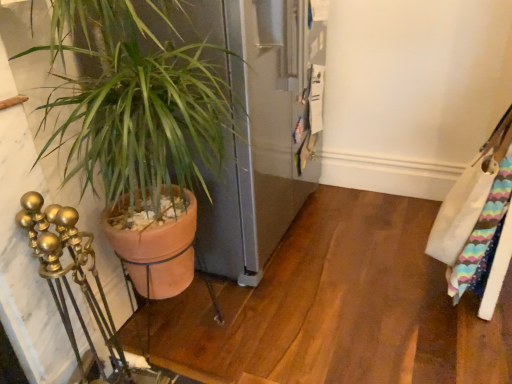
Question: Does terracotta pot at left lie behind white fabric messenger bag at right?

Choices:
 (A) no
 (B) yes

Answer: (A)

Question: Does terracotta pot at left lie in front of white fabric messenger bag at right?

Choices:
 (A) yes
 (B) no

Answer: (A)

Question: Is terracotta pot at left at the right side of white fabric messenger bag at right?

Choices:
 (A) no
 (B) yes

Answer: (A)

Question: From a real-world perspective, is terracotta pot at left physically below white fabric messenger bag at right?

Choices:
 (A) no
 (B) yes

Answer: (A)

Question: From the image's perspective, is terracotta pot at left beneath white fabric messenger bag at right?

Choices:
 (A) yes
 (B) no

Answer: (A)

Question: From the image's perspective, is terracotta pot at left located above white fabric messenger bag at right?

Choices:
 (A) yes
 (B) no

Answer: (B)

Question: Is white fabric messenger bag at right bigger than terracotta pot at left?

Choices:
 (A) yes
 (B) no

Answer: (B)

Question: From the image's perspective, is white fabric messenger bag at right above terracotta pot at left?

Choices:
 (A) yes
 (B) no

Answer: (A)

Question: Does white fabric messenger bag at right have a greater height compared to terracotta pot at left?

Choices:
 (A) yes
 (B) no

Answer: (B)

Question: Is white fabric messenger bag at right facing away from terracotta pot at left?

Choices:
 (A) no
 (B) yes

Answer: (A)

Question: Considering the relative sizes of white fabric messenger bag at right and terracotta pot at left in the image provided, is white fabric messenger bag at right smaller than terracotta pot at left?

Choices:
 (A) no
 (B) yes

Answer: (B)

Question: From a real-world perspective, is white fabric messenger bag at right physically below terracotta pot at left?

Choices:
 (A) no
 (B) yes

Answer: (B)

Question: From the image's perspective, is terracotta pot at left above or below white fabric messenger bag at right?

Choices:
 (A) below
 (B) above

Answer: (A)